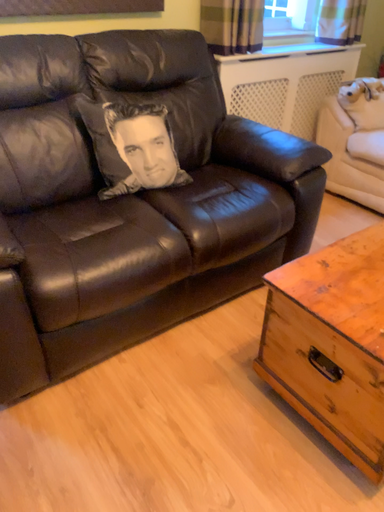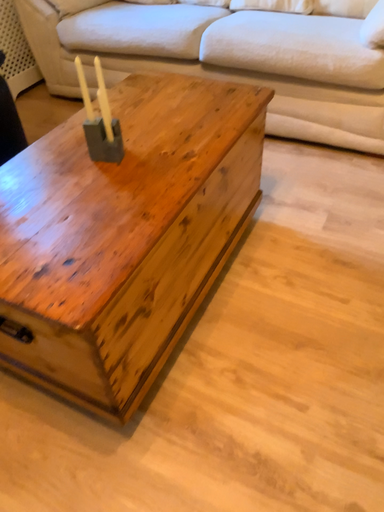
Question: How did the camera likely rotate when shooting the video?

Choices:
 (A) rotated right
 (B) rotated left

Answer: (A)